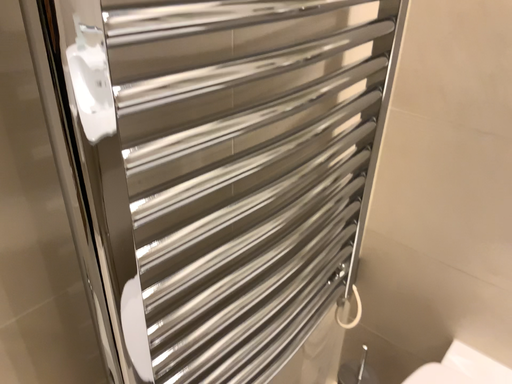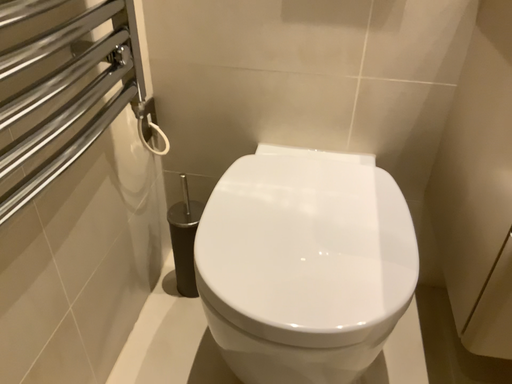
Question: Which way did the camera rotate in the video?

Choices:
 (A) rotated left
 (B) rotated right

Answer: (B)